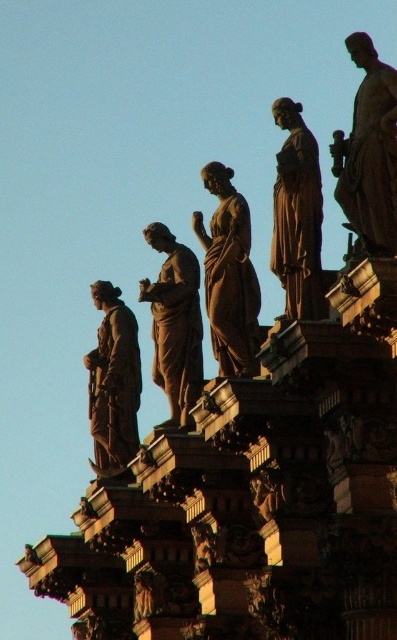
You are an art conservator assessing the statues in the image. You need to determine which statue requires more space for storage. Based on the statues labeled as matte bronze statue at center and brown polished statue at center, which one would you prioritize for a larger storage area?

The brown polished statue at center is larger than the matte bronze statue at center, so it would require more space and should be prioritized for a larger storage area.